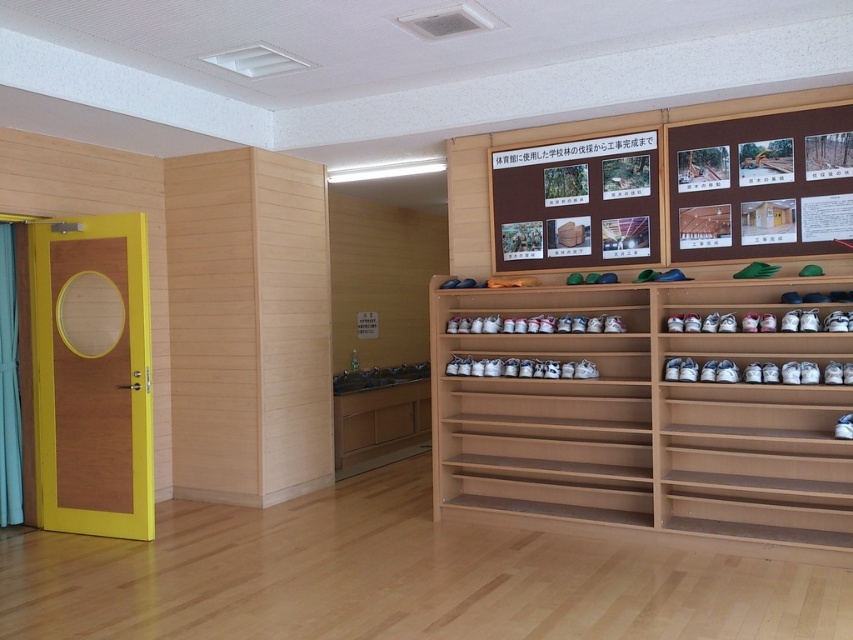
Question: Is brown wooden bulletin board at upper center in front of wooden bulletin board at upper center?

Choices:
 (A) no
 (B) yes

Answer: (B)

Question: Which of the following is the farthest from the observer?

Choices:
 (A) (802, 112)
 (B) (699, 504)

Answer: (B)

Question: Does wooden shoe rack at center appear under brown wooden bulletin board at upper center?

Choices:
 (A) yes
 (B) no

Answer: (A)

Question: Among these objects, which one is nearest to the camera?

Choices:
 (A) wooden bulletin board at upper center
 (B) brown wooden bulletin board at upper center

Answer: (B)

Question: Considering the real-world distances, which object is farthest from the wooden shoe rack at center?

Choices:
 (A) brown wooden bulletin board at upper center
 (B) wooden bulletin board at upper center

Answer: (A)

Question: In this image, where is brown wooden bulletin board at upper center located relative to wooden bulletin board at upper center?

Choices:
 (A) below
 (B) above

Answer: (B)